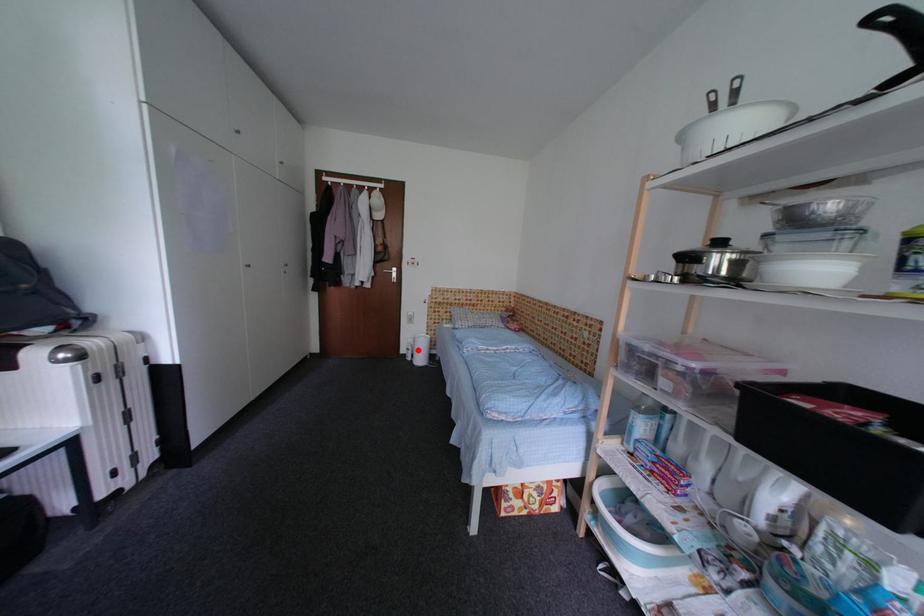
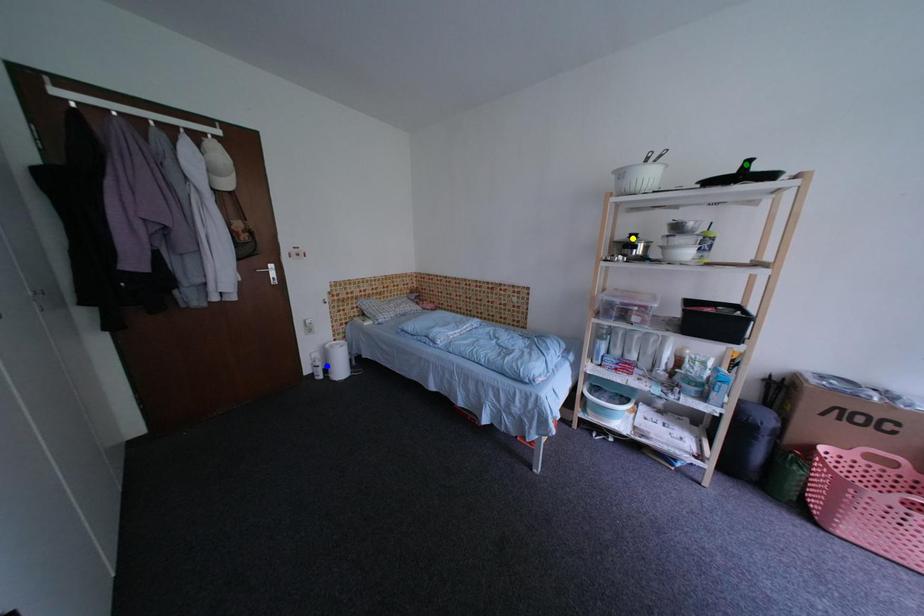
Question: I am providing you with two images of the same scene from different viewpoints. A red point is marked on the first image. You are given multiple points on the second image. Which mark in image 2 goes with the point in image 1?

Choices:
 (A) green point
 (B) yellow point
 (C) blue point

Answer: (C)